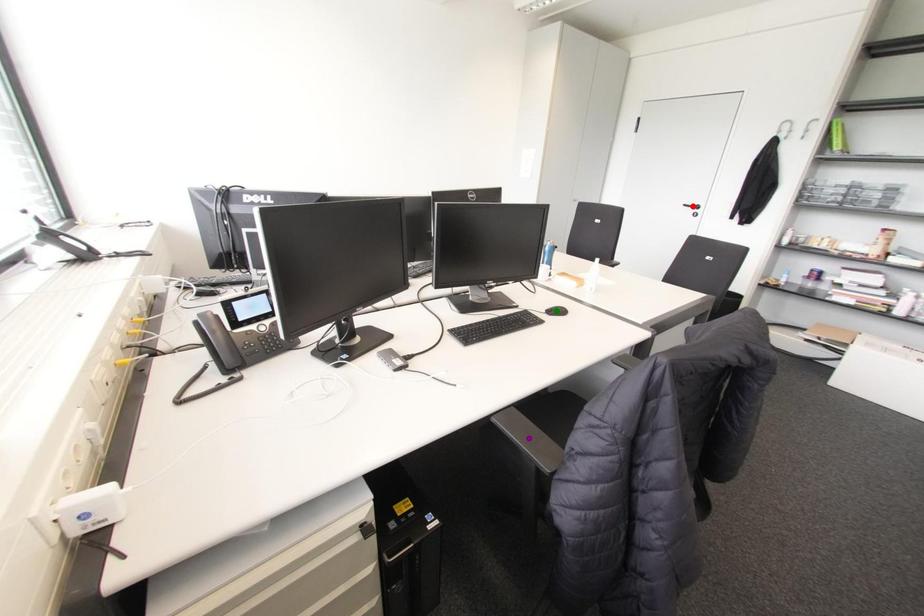
Order these from nearest to farthest:
- red point
- green point
- purple point

purple point < green point < red point